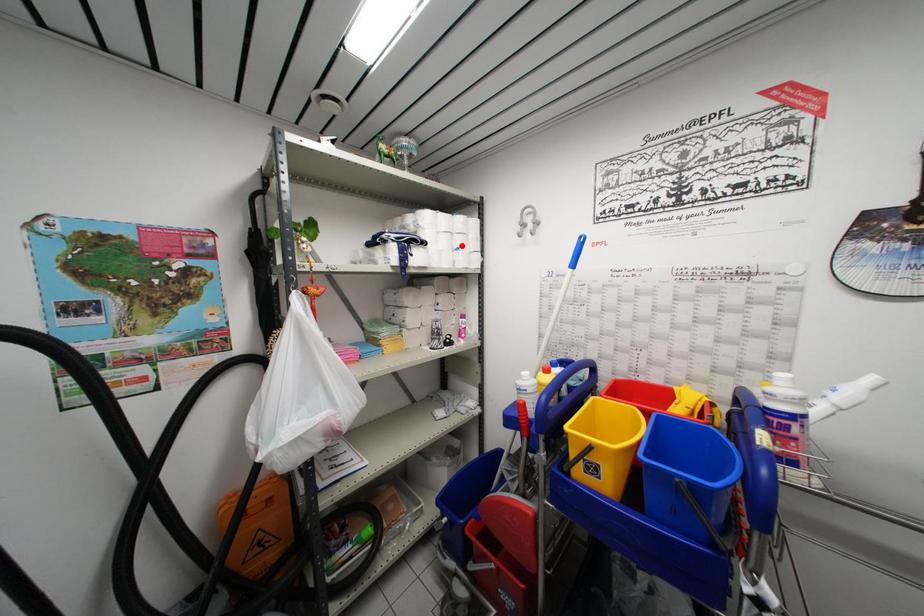
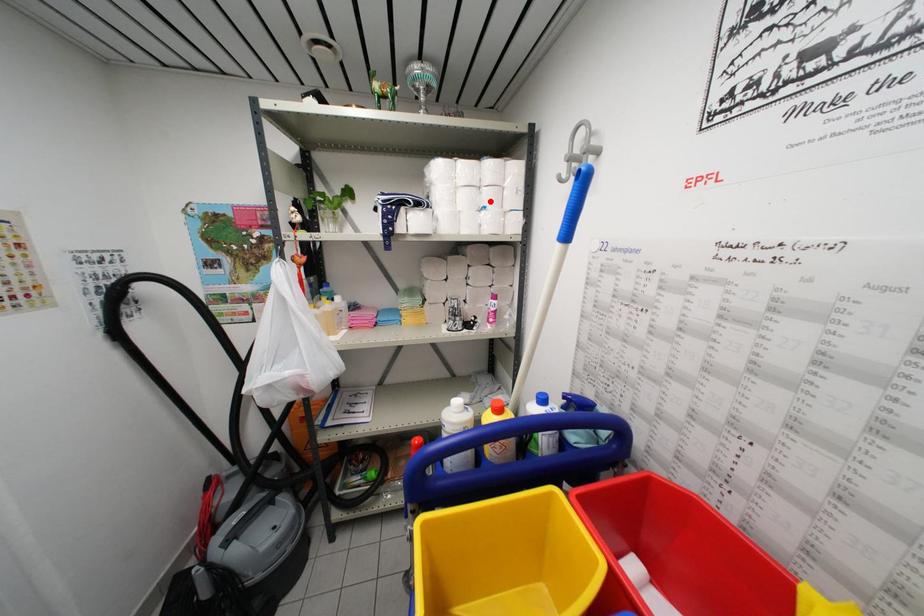
I am providing you with two images of the same scene from different viewpoints. A red point is marked on the first image and another point is marked on the second image. Is the marked point in image1 the same physical position as the marked point in image2?

Yes